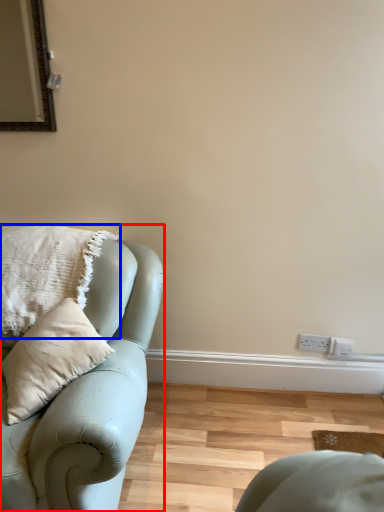
Question: Which point is further to the camera, studio couch (highlighted by a red box) or pillow (highlighted by a blue box)?

Choices:
 (A) studio couch
 (B) pillow

Answer: (B)